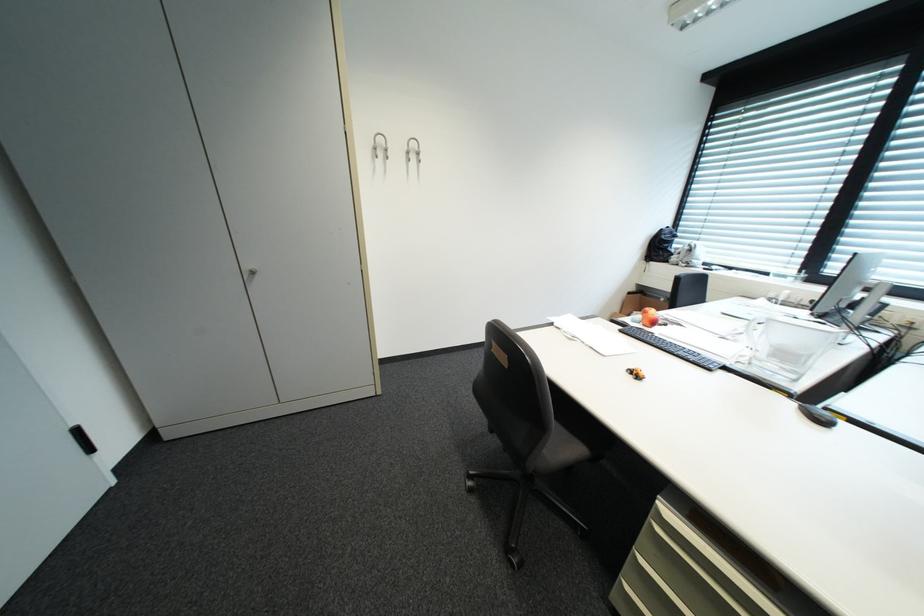
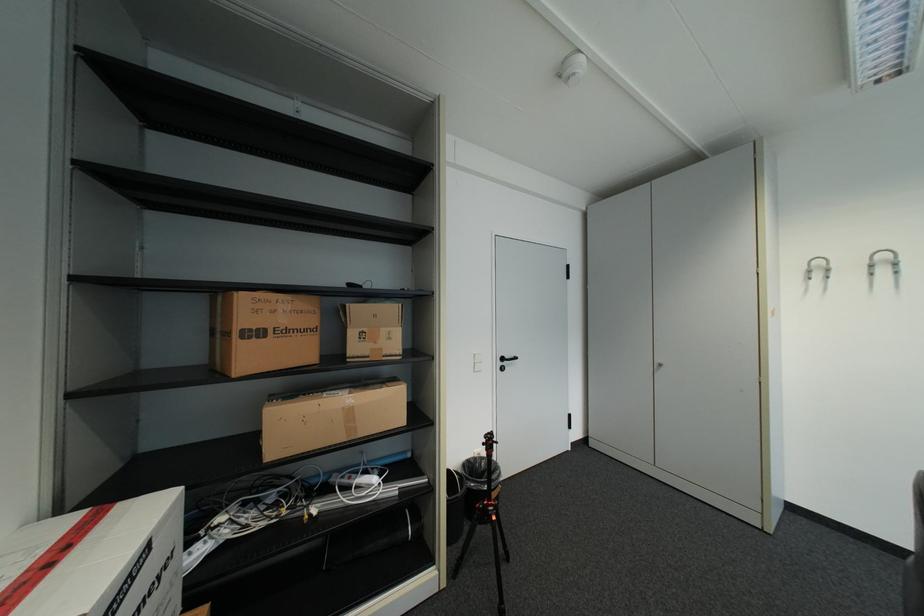
Question: The camera is either moving clockwise (left) or counter-clockwise (right) around the object. The first image is from the beginning of the video and the second image is from the end. Is the camera moving left or right when shooting the video?

Choices:
 (A) Left
 (B) Right

Answer: (B)